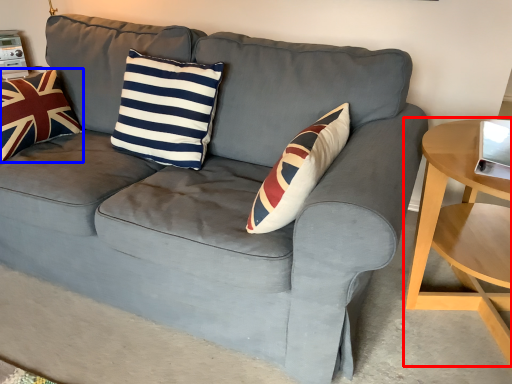
Question: Which point is further to the camera, table (highlighted by a red box) or pillow (highlighted by a blue box)?

Choices:
 (A) table
 (B) pillow

Answer: (B)